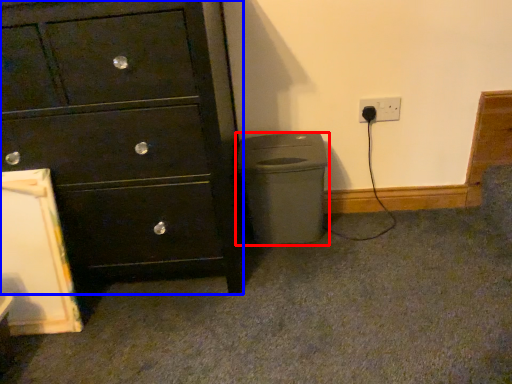
Question: Which object appears closest to the camera in this image, waste container (highlighted by a red box) or chest of drawers (highlighted by a blue box)?

Choices:
 (A) waste container
 (B) chest of drawers

Answer: (B)